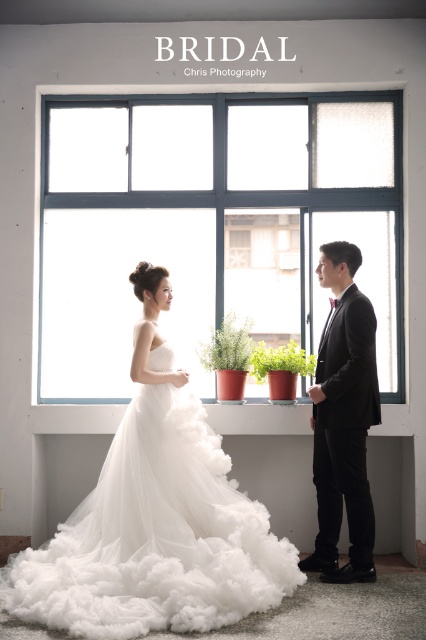
Between clear glass window at center and white tulle dress at center, which one has less height?

white tulle dress at center is shorter.

The height and width of the screenshot is (640, 426). Describe the element at coordinates (215, 218) in the screenshot. I see `clear glass window at center` at that location.

This screenshot has width=426, height=640. What are the coordinates of `clear glass window at center` in the screenshot? It's located at (215, 218).

How much distance is there between clear glass window at center and black satin suit at right?

clear glass window at center is 3.56 feet from black satin suit at right.

Is point (247, 307) farther from viewer compared to point (334, 528)?

Yes, point (247, 307) is behind point (334, 528).

You are a GUI agent. You are given a task and a screenshot of the screen. Output one action in this format:
    pyautogui.click(x=<x>, y=<y>)
    Task: Click on the clear glass window at center
    The width and height of the screenshot is (426, 640).
    Given the screenshot: What is the action you would take?
    pyautogui.click(x=215, y=218)

Can you confirm if white tulle dress at center is bigger than black satin suit at right?

Indeed, white tulle dress at center has a larger size compared to black satin suit at right.

Is white tulle dress at center further to the viewer compared to black satin suit at right?

That is False.

Which is behind, point (112, 442) or point (311, 417)?

The point (311, 417) is more distant.

In order to click on white tulle dress at center in this screenshot , I will do `click(155, 536)`.